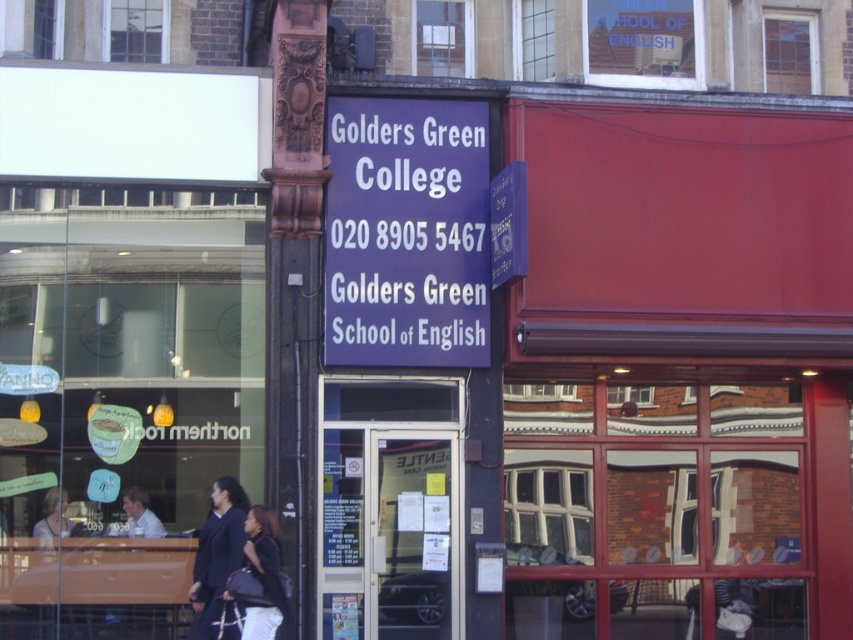
You are standing at the entrance of the building and want to locate the purple matte sign at center. According to the coordinates provided, where should you look relative to the entrance?

The purple matte sign at center is located at coordinates point (405, 234), which is approximately at the center of the image. Since you are at the entrance, you should look straight ahead to find it.

You are a customer entering the Golders Green College building and see the dark blue fabric coat at center and the matte black jacket at center. Which item is closer to the floor?

The dark blue fabric coat at center is closer to the floor because it is located below the matte black jacket at center.

You are a delivery person who needs to hand over a package to the recipient at the Golders Green College. You see the purple matte sign at center and the matte black jacket at center. Which object should you look for to ensure you are at the correct building?

The purple matte sign at center is taller than the matte black jacket at center, so you should look for the taller purple matte sign at center to confirm you are at the correct building.